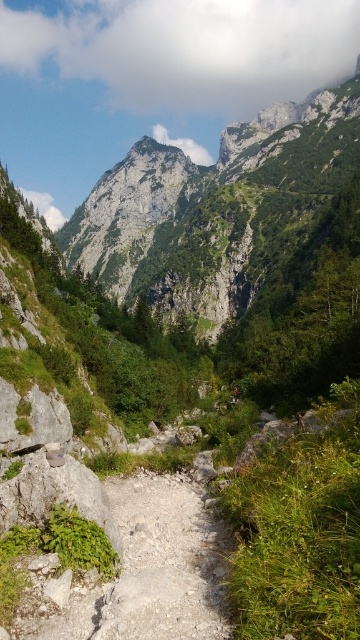
Who is lower down, rugged stone mountain at upper center or red fabric mountain biker at center?

red fabric mountain biker at center is below.

Between point (127, 176) and point (235, 396), which one is positioned in front?

Point (235, 396) is in front.

I want to click on rugged stone mountain at upper center, so click(x=216, y=209).

Based on the photo, does rugged stone mountain at upper center come behind dusty gravel path at center?

Yes.

Is the position of rugged stone mountain at upper center less distant than that of dusty gravel path at center?

No, rugged stone mountain at upper center is further to the viewer.

Is point (160, 161) less distant than point (213, 580)?

No.

At what (x,y) coordinates should I click in order to perform the action: click on rugged stone mountain at upper center. Please return your answer as a coordinate pair (x, y). The height and width of the screenshot is (640, 360). Looking at the image, I should click on (216, 209).

Looking at this image, does dusty gravel path at center appear over red fabric mountain biker at center?

No, dusty gravel path at center is not above red fabric mountain biker at center.

Does point (149, 632) come behind point (232, 397)?

No, it is in front of (232, 397).

You are a GUI agent. You are given a task and a screenshot of the screen. Output one action in this format:
    pyautogui.click(x=<x>, y=<y>)
    Task: Click on the dusty gravel path at center
    
    Given the screenshot: What is the action you would take?
    pyautogui.click(x=164, y=563)